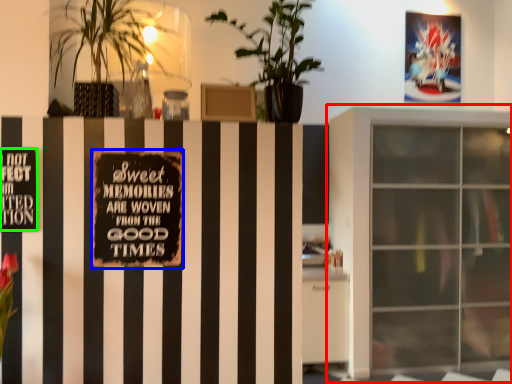
Question: Considering the real-world distances, which object is closest to window (highlighted by a red box)? bulletin board (highlighted by a blue box) or warning sign (highlighted by a green box).

Choices:
 (A) bulletin board
 (B) warning sign

Answer: (A)